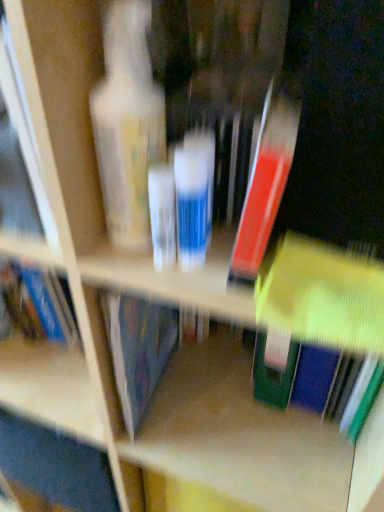
Question: From a real-world perspective, is matte plastic bottle at left positioned above or below matte red book at center, marked as the 2th book in a bottom-to-top arrangement?

Choices:
 (A) above
 (B) below

Answer: (A)

Question: In the image, is matte plastic bottle at left positioned in front of or behind matte red book at center, marked as the 2th book in a bottom-to-top arrangement?

Choices:
 (A) front
 (B) behind

Answer: (B)

Question: Which is nearer to the matte yellow book at center, which appears as the 2th book when viewed from the top?

Choices:
 (A) translucent plastic tube at center
 (B) matte red book at center, positioned as the first book in top-to-bottom order
 (C) matte plastic bottle at left

Answer: (B)

Question: Estimate the real-world distances between objects in this image. Which object is farther from the matte yellow book at center, which appears as the 2th book when viewed from the top?

Choices:
 (A) matte plastic bottle at left
 (B) translucent plastic tube at center
 (C) matte red book at center, marked as the 2th book in a bottom-to-top arrangement

Answer: (A)